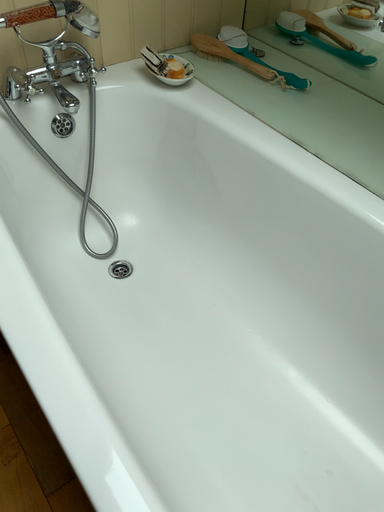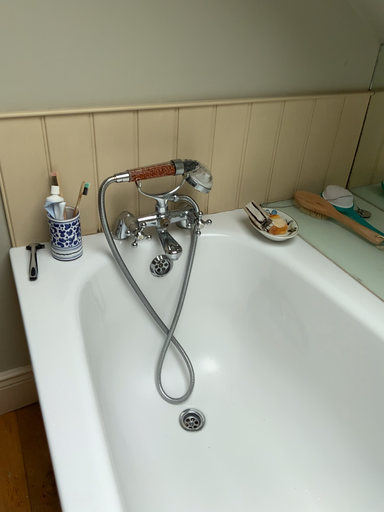
Question: How did the camera likely rotate when shooting the video?

Choices:
 (A) rotated right
 (B) rotated left

Answer: (B)